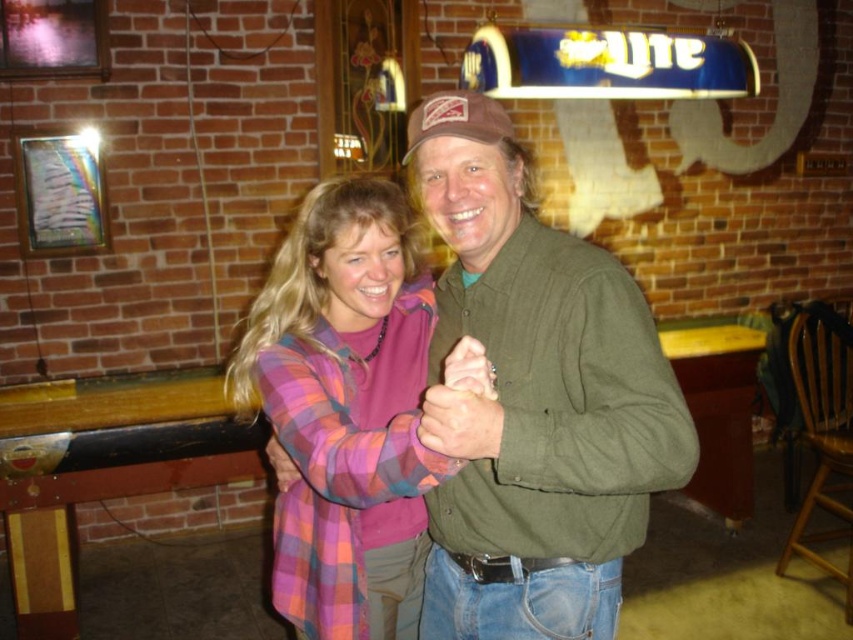
Consider the image. Between brown fabric baseball cap at center and matte brown ring at center, which one is positioned lower?

matte brown ring at center

Which is in front, point (486, 113) or point (448, 368)?

Point (448, 368)

Where is `brown fabric baseball cap at center`? This screenshot has height=640, width=853. brown fabric baseball cap at center is located at coordinates (456, 120).

Between point (409, 132) and point (276, 458), which one is positioned behind?

The point (276, 458) is more distant.

This screenshot has width=853, height=640. In order to click on brown fabric baseball cap at center in this screenshot , I will do click(x=456, y=120).

Find the location of `brown fabric baseball cap at center`. brown fabric baseball cap at center is located at coordinates (456, 120).

How distant is smooth skin hand at center from matte plaid shirt at center?

23.15 inches

Can you confirm if smooth skin hand at center is thinner than matte plaid shirt at center?

Correct, smooth skin hand at center's width is less than matte plaid shirt at center's.

Find the location of a particular element. smooth skin hand at center is located at coordinates (460, 422).